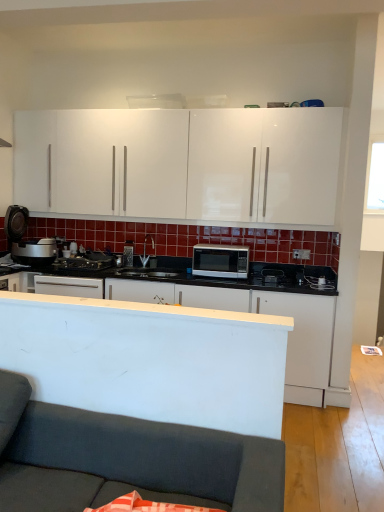
Question: Considering the relative positions of dark gray fabric couch at lower left and transparent glass window at upper right in the image provided, is dark gray fabric couch at lower left to the right of transparent glass window at upper right from the viewer's perspective?

Choices:
 (A) no
 (B) yes

Answer: (A)

Question: Considering the relative sizes of dark gray fabric couch at lower left and transparent glass window at upper right in the image provided, is dark gray fabric couch at lower left bigger than transparent glass window at upper right?

Choices:
 (A) no
 (B) yes

Answer: (B)

Question: From a real-world perspective, is dark gray fabric couch at lower left located beneath transparent glass window at upper right?

Choices:
 (A) yes
 (B) no

Answer: (A)

Question: Is dark gray fabric couch at lower left oriented away from transparent glass window at upper right?

Choices:
 (A) no
 (B) yes

Answer: (B)

Question: From the image's perspective, is dark gray fabric couch at lower left over transparent glass window at upper right?

Choices:
 (A) yes
 (B) no

Answer: (B)

Question: Is dark gray fabric couch at lower left situated inside white matte microwave at center, the second cabinetry from the top, or outside?

Choices:
 (A) outside
 (B) inside

Answer: (A)

Question: Considering the positions of dark gray fabric couch at lower left and white matte microwave at center, the second cabinetry from the top, in the image, is dark gray fabric couch at lower left bigger or smaller than white matte microwave at center, the second cabinetry from the top,?

Choices:
 (A) small
 (B) big

Answer: (A)

Question: Considering their positions, is dark gray fabric couch at lower left located in front of or behind white matte microwave at center, the second cabinetry from the top?

Choices:
 (A) behind
 (B) front

Answer: (B)

Question: From a real-world perspective, is dark gray fabric couch at lower left positioned above or below white matte microwave at center, which is counted as the first cabinetry, starting from the bottom?

Choices:
 (A) below
 (B) above

Answer: (A)

Question: In terms of height, does white matte microwave at center, the second cabinetry from the top, look taller or shorter compared to satin silver microwave at center?

Choices:
 (A) tall
 (B) short

Answer: (A)

Question: Is point (289, 350) closer or farther from the camera than point (218, 267)?

Choices:
 (A) closer
 (B) farther

Answer: (A)

Question: Which is correct: white matte microwave at center, the second cabinetry from the top, is inside satin silver microwave at center, or outside of it?

Choices:
 (A) outside
 (B) inside

Answer: (A)

Question: In terms of width, does white matte microwave at center, the second cabinetry from the top, look wider or thinner when compared to satin silver microwave at center?

Choices:
 (A) wide
 (B) thin

Answer: (A)

Question: Is satin silver microwave at center taller or shorter than dark gray fabric couch at lower left?

Choices:
 (A) tall
 (B) short

Answer: (B)

Question: Is satin silver microwave at center to the left or to the right of dark gray fabric couch at lower left in the image?

Choices:
 (A) left
 (B) right

Answer: (B)